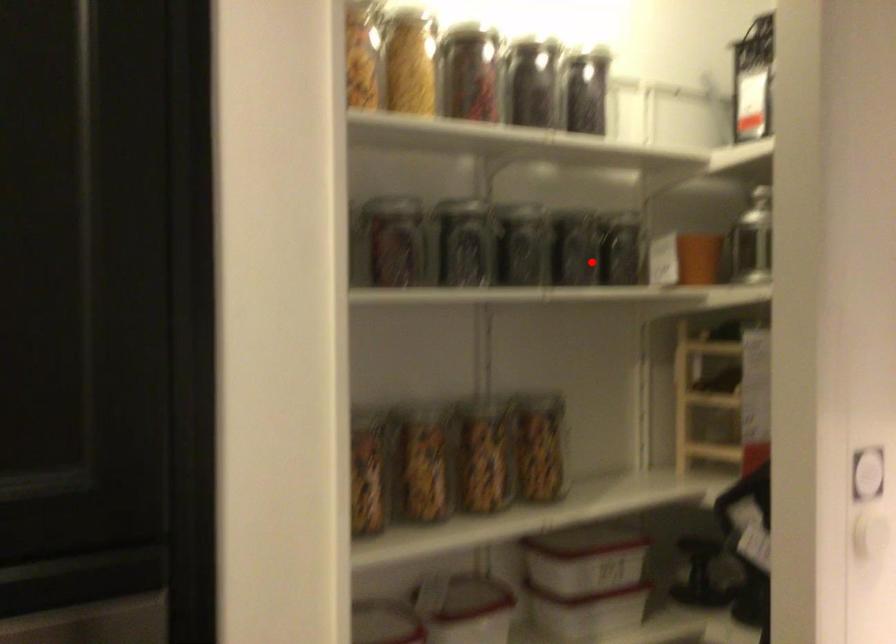
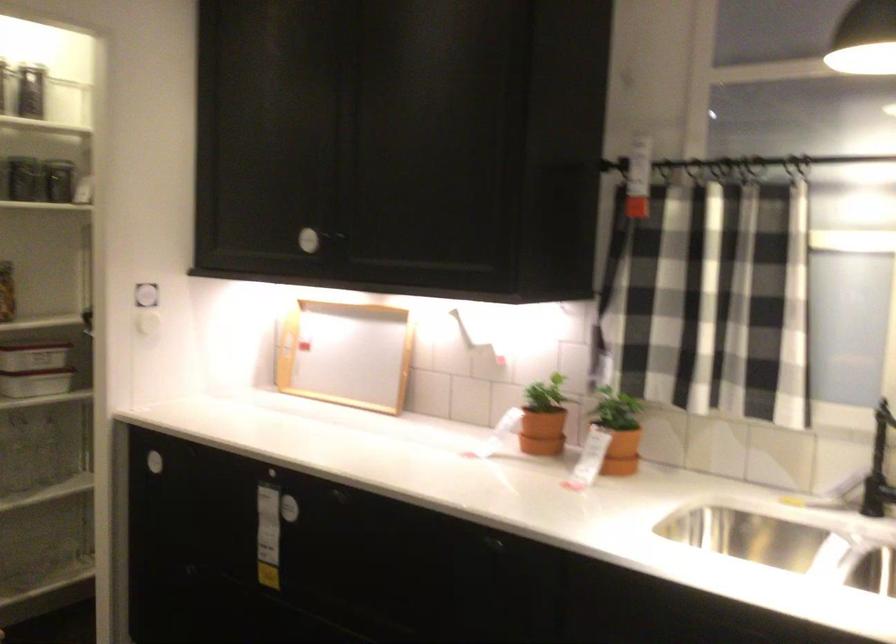
In the second image, find the point that corresponds to the highlighted location in the first image.

(31, 187)